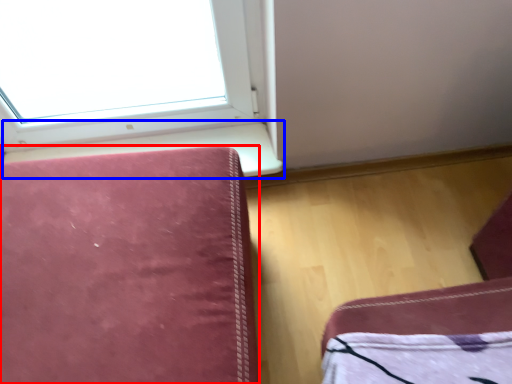
Question: Which point is further to the camera, furniture (highlighted by a red box) or window sill (highlighted by a blue box)?

Choices:
 (A) furniture
 (B) window sill

Answer: (B)